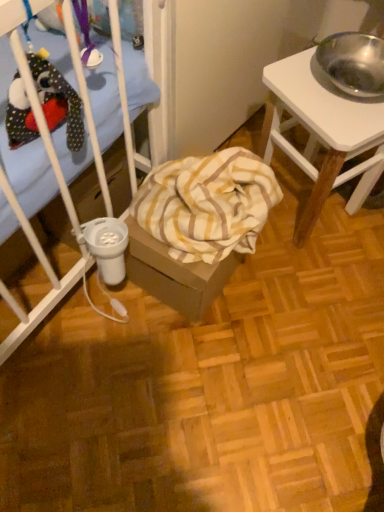
At what (x,y) coordinates should I click in order to perform the action: click on free spot to the right of yellow striped fabric at center. Please return your answer as a coordinate pair (x, y). Image resolution: width=384 pixels, height=512 pixels. Looking at the image, I should click on (297, 290).